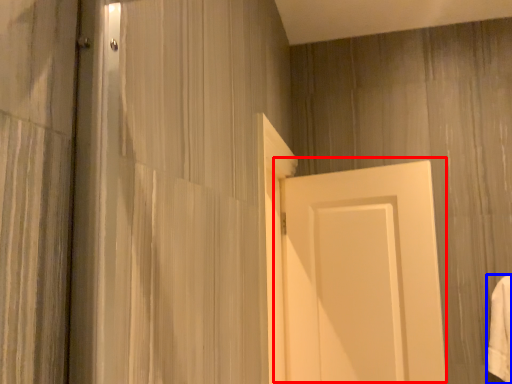
Question: Which object is closer to the camera taking this photo, door (highlighted by a red box) or bath towel (highlighted by a blue box)?

Choices:
 (A) door
 (B) bath towel

Answer: (A)